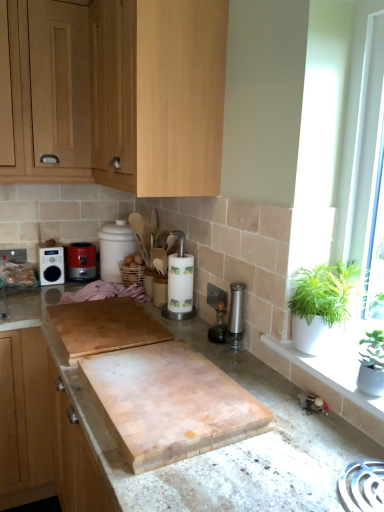
Question: Considering the relative sizes of light wood cabinet at left, the third cabinetry when ordered from top to bottom, and white wooden frame at right in the image provided, is light wood cabinet at left, the third cabinetry when ordered from top to bottom, shorter than white wooden frame at right?

Choices:
 (A) no
 (B) yes

Answer: (B)

Question: Is light wood cabinet at left, the third cabinetry when ordered from top to bottom, smaller than white wooden frame at right?

Choices:
 (A) no
 (B) yes

Answer: (A)

Question: Considering the relative positions of light wood cabinet at left, the third cabinetry when ordered from top to bottom, and white wooden frame at right in the image provided, is light wood cabinet at left, the third cabinetry when ordered from top to bottom, in front of white wooden frame at right?

Choices:
 (A) no
 (B) yes

Answer: (A)

Question: Is light wood cabinet at left, the first cabinetry from the bottom, thinner than white wooden frame at right?

Choices:
 (A) yes
 (B) no

Answer: (B)

Question: From a real-world perspective, is light wood cabinet at left, the first cabinetry from the bottom, located higher than white wooden frame at right?

Choices:
 (A) no
 (B) yes

Answer: (A)

Question: Considering their positions, is light wood cabinet at left, the first cabinetry from the bottom, located in front of or behind metallic red toaster at left?

Choices:
 (A) behind
 (B) front

Answer: (B)

Question: From the image's perspective, relative to metallic red toaster at left, is light wood cabinet at left, the third cabinetry when ordered from top to bottom, above or below?

Choices:
 (A) above
 (B) below

Answer: (B)

Question: In the image, is light wood cabinet at left, the first cabinetry from the bottom, on the left side or the right side of metallic red toaster at left?

Choices:
 (A) right
 (B) left

Answer: (B)

Question: From a real-world perspective, is light wood cabinet at left, the third cabinetry when ordered from top to bottom, positioned above or below metallic red toaster at left?

Choices:
 (A) below
 (B) above

Answer: (A)

Question: From a real-world perspective, is green leafy plant at right, the first houseplant positioned from the back, positioned above or below light wood cabinet at left, the third cabinetry when ordered from top to bottom?

Choices:
 (A) above
 (B) below

Answer: (A)

Question: Considering the positions of green leafy plant at right, the second houseplant when ordered from front to back, and light wood cabinet at left, the first cabinetry from the bottom, in the image, is green leafy plant at right, the second houseplant when ordered from front to back, taller or shorter than light wood cabinet at left, the first cabinetry from the bottom,?

Choices:
 (A) tall
 (B) short

Answer: (B)

Question: Is point (334, 310) positioned closer to the camera than point (46, 357)?

Choices:
 (A) farther
 (B) closer

Answer: (B)

Question: From the image's perspective, is green leafy plant at right, the first houseplant positioned from the back, located above or below light wood cabinet at left, the third cabinetry when ordered from top to bottom?

Choices:
 (A) below
 (B) above

Answer: (B)

Question: In terms of height, does white wooden frame at right look taller or shorter compared to light wood cabinet at left, the first cabinetry from the bottom?

Choices:
 (A) tall
 (B) short

Answer: (A)

Question: Would you say white wooden frame at right is inside or outside light wood cabinet at left, the first cabinetry from the bottom?

Choices:
 (A) inside
 (B) outside

Answer: (B)